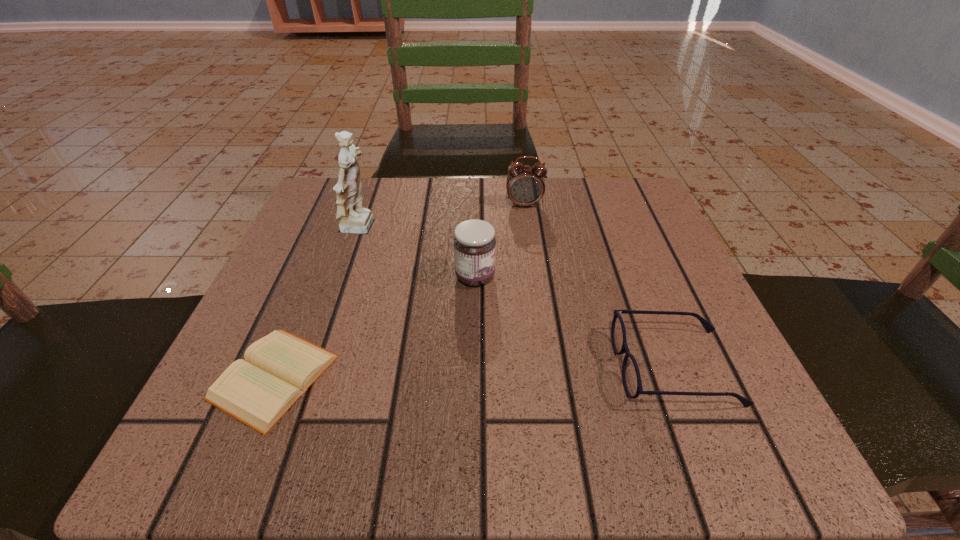
At what (x,y) coordinates should I click in order to perform the action: click on empty location between the shortest object and the farthest object. Please return your answer as a coordinate pair (x, y). The height and width of the screenshot is (540, 960). Looking at the image, I should click on (399, 291).

At what (x,y) coordinates should I click in order to perform the action: click on empty location between the rightmost object and the third object from right to left. Please return your answer as a coordinate pair (x, y). This screenshot has height=540, width=960. Looking at the image, I should click on (575, 322).

Where is `vacant area that lies between the shortest object and the second object from right to left`? The height and width of the screenshot is (540, 960). vacant area that lies between the shortest object and the second object from right to left is located at coordinates (399, 291).

Locate which object ranks in proximity to the tallest object. Please provide its 2D coordinates. Your answer should be formatted as a tuple, i.e. [(x, y)], where the tuple contains the x and y coordinates of a point satisfying the conditions above.

[(474, 243)]

At what (x,y) coordinates should I click in order to perform the action: click on the third closest object to the jam. Please return your answer as a coordinate pair (x, y). Looking at the image, I should click on (279, 368).

Identify the location of vacant area that satisfies the following two spatial constraints: 1. on the face of the farthest object; 2. on the front label of the jam. This screenshot has width=960, height=540. (534, 276).

Where is `vacant space that satisfies the following two spatial constraints: 1. on the front-facing side of the second shortest object; 2. on the front side of the shortest object`? This screenshot has height=540, width=960. vacant space that satisfies the following two spatial constraints: 1. on the front-facing side of the second shortest object; 2. on the front side of the shortest object is located at coordinates (678, 377).